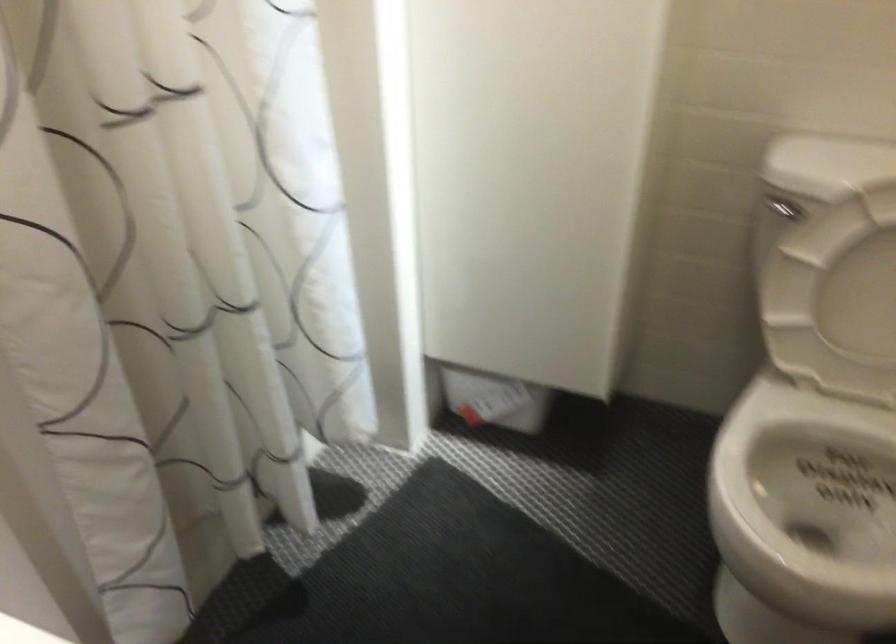
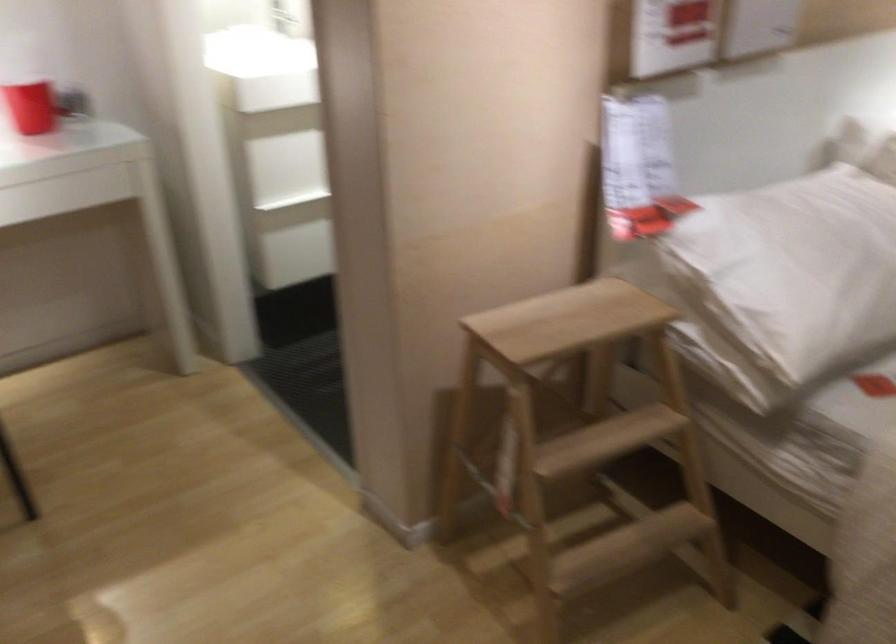
Question: I am providing you with two images of the same scene from different viewpoints. Please identify which objects are invisible in image2.

Choices:
 (A) yellow tape dispenser
 (B) white toilet lid
 (C) red cup
 (D) wooden step stool

Answer: (B)